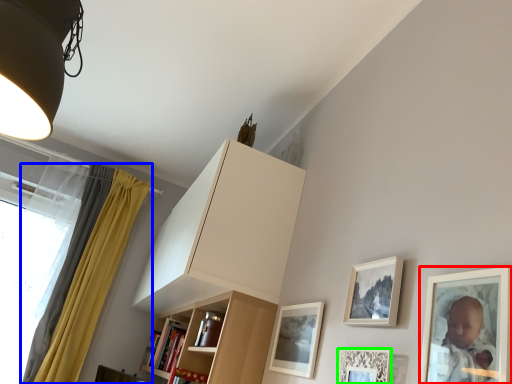
Question: Considering the real-world distances, which object is farthest from picture frame (highlighted by a red box)? curtain (highlighted by a blue box) or picture frame (highlighted by a green box)?

Choices:
 (A) curtain
 (B) picture frame

Answer: (A)